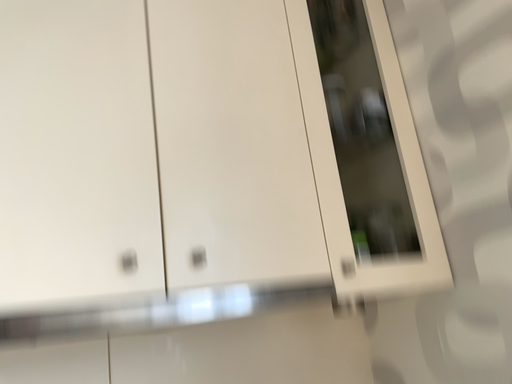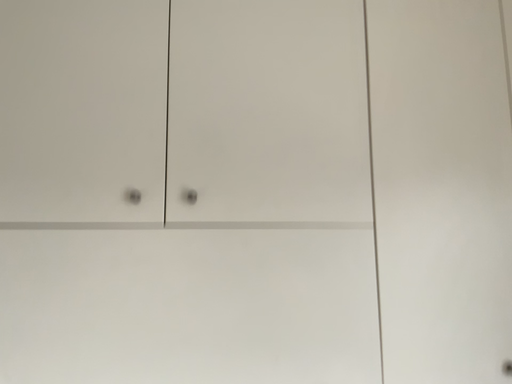
Question: Which way did the camera rotate in the video?

Choices:
 (A) rotated upward
 (B) rotated downward

Answer: (B)